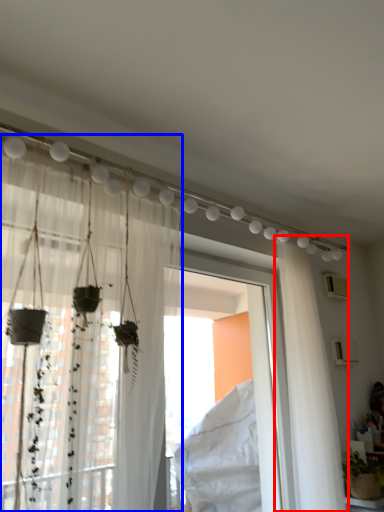
Question: Which point is further to the camera, curtain (highlighted by a red box) or curtain (highlighted by a blue box)?

Choices:
 (A) curtain
 (B) curtain

Answer: (A)